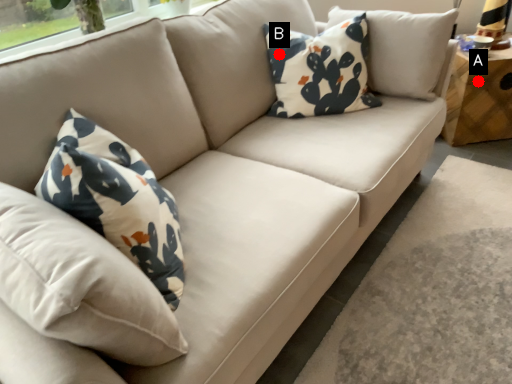
Question: Two points are circled on the image, labeled by A and B beside each circle. Which of the following is the closest to the observer?

Choices:
 (A) A is closer
 (B) B is closer

Answer: (B)